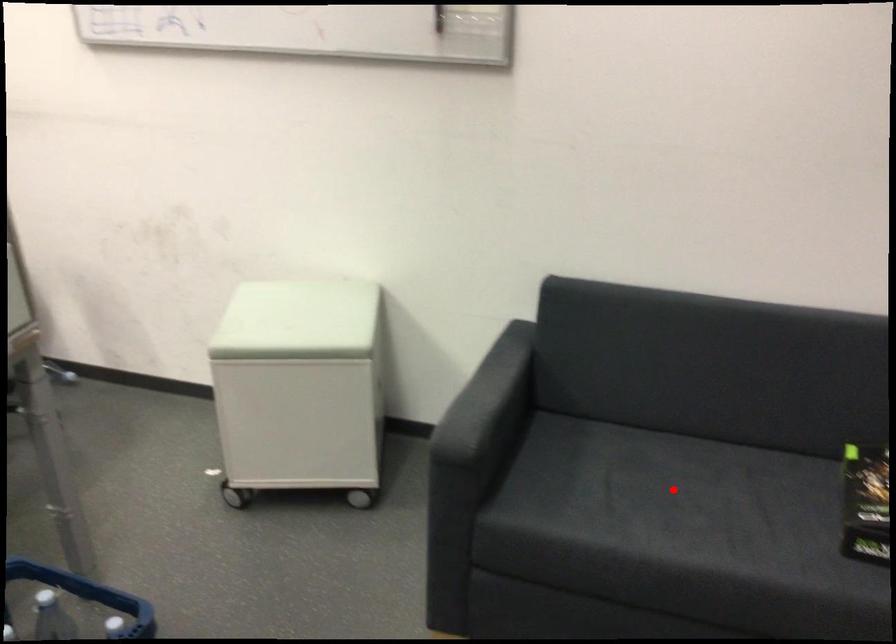
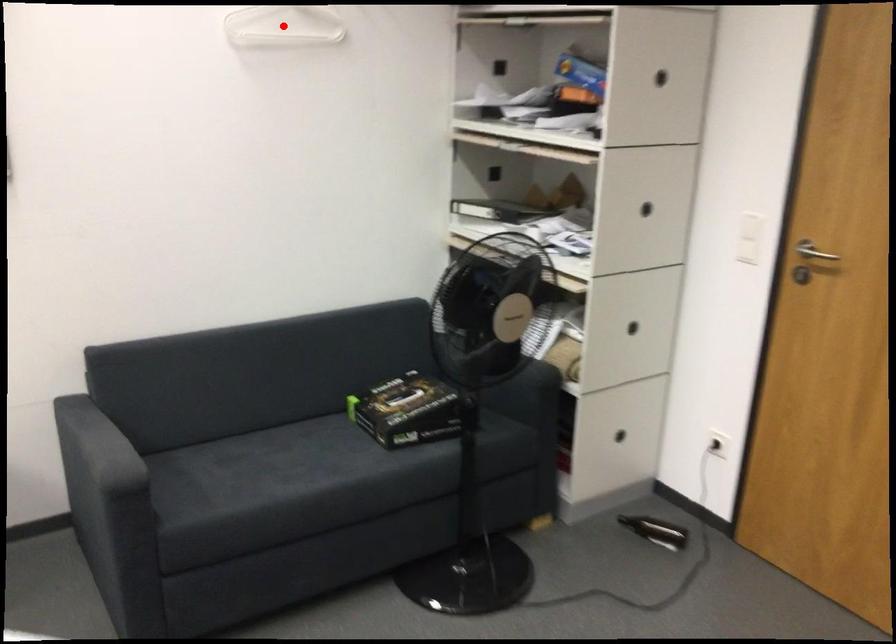
I am providing you with two images of the same scene from different viewpoints. A red point is marked on the first image and another point is marked on the second image. Is the marked point in image1 the same physical position as the marked point in image2?

No